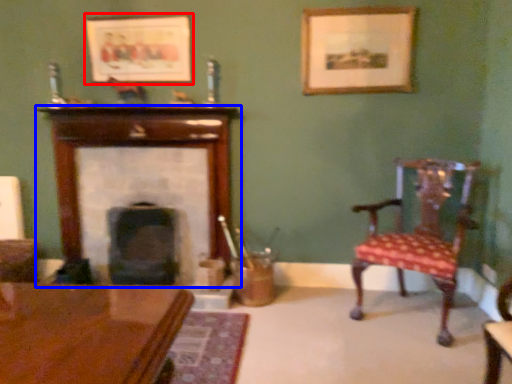
Question: Which object is further to the camera taking this photo, picture frame (highlighted by a red box) or fireplace (highlighted by a blue box)?

Choices:
 (A) picture frame
 (B) fireplace

Answer: (B)